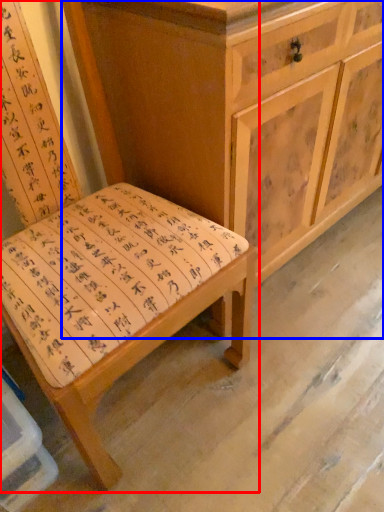
Question: Which of the following is the farthest to the observer, chair (highlighted by a red box) or chest of drawers (highlighted by a blue box)?

Choices:
 (A) chair
 (B) chest of drawers

Answer: (B)